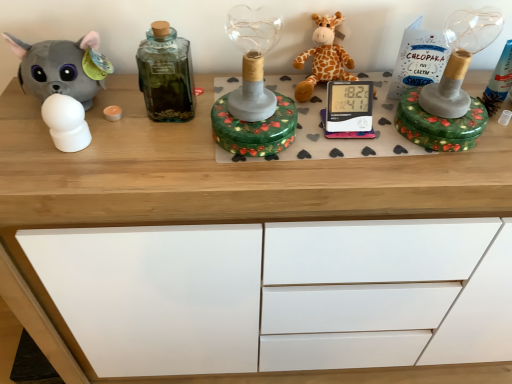
Question: Is green glass bottle at center inside matte gray plush toy at left, the 1th toy when ordered from left to right?

Choices:
 (A) no
 (B) yes

Answer: (A)

Question: From the image's perspective, is matte gray plush toy at left, the 1th toy when ordered from left to right, located beneath green glass bottle at center?

Choices:
 (A) yes
 (B) no

Answer: (A)

Question: From a real-world perspective, is matte gray plush toy at left, the 2th toy when ordered from right to left, located higher than green glass bottle at center?

Choices:
 (A) no
 (B) yes

Answer: (A)

Question: Considering the relative sizes of matte gray plush toy at left, the 1th toy when ordered from left to right, and green glass bottle at center in the image provided, is matte gray plush toy at left, the 1th toy when ordered from left to right, shorter than green glass bottle at center?

Choices:
 (A) yes
 (B) no

Answer: (A)

Question: Is matte gray plush toy at left, the 2th toy when ordered from right to left, beside green glass bottle at center?

Choices:
 (A) no
 (B) yes

Answer: (A)

Question: From a real-world perspective, is green glass bottle at center above or below orange plush giraffe at center, the first toy in the right-to-left sequence?

Choices:
 (A) below
 (B) above

Answer: (B)

Question: In the image, is green glass bottle at center on the left side or the right side of orange plush giraffe at center, the first toy in the right-to-left sequence?

Choices:
 (A) right
 (B) left

Answer: (B)

Question: Considering their positions, is green glass bottle at center located in front of or behind orange plush giraffe at center, acting as the second toy starting from the left?

Choices:
 (A) front
 (B) behind

Answer: (A)

Question: Considering the positions of green glass bottle at center and orange plush giraffe at center, acting as the second toy starting from the left, in the image, is green glass bottle at center taller or shorter than orange plush giraffe at center, acting as the second toy starting from the left,?

Choices:
 (A) short
 (B) tall

Answer: (B)

Question: In terms of size, does orange plush giraffe at center, the first toy in the right-to-left sequence, appear bigger or smaller than matte gray plush toy at left, the 2th toy when ordered from right to left?

Choices:
 (A) small
 (B) big

Answer: (A)

Question: Looking at their shapes, would you say orange plush giraffe at center, the first toy in the right-to-left sequence, is wider or thinner than matte gray plush toy at left, the 2th toy when ordered from right to left?

Choices:
 (A) wide
 (B) thin

Answer: (A)

Question: Is point (324, 21) closer or farther from the camera than point (60, 79)?

Choices:
 (A) farther
 (B) closer

Answer: (A)

Question: In terms of height, does orange plush giraffe at center, the first toy in the right-to-left sequence, look taller or shorter compared to matte gray plush toy at left, the 2th toy when ordered from right to left?

Choices:
 (A) tall
 (B) short

Answer: (B)

Question: From a real-world perspective, is matte gray plush toy at left, the 2th toy when ordered from right to left, physically located above or below green glass bottle at center?

Choices:
 (A) above
 (B) below

Answer: (B)

Question: In terms of height, does matte gray plush toy at left, the 2th toy when ordered from right to left, look taller or shorter compared to green glass bottle at center?

Choices:
 (A) tall
 (B) short

Answer: (B)